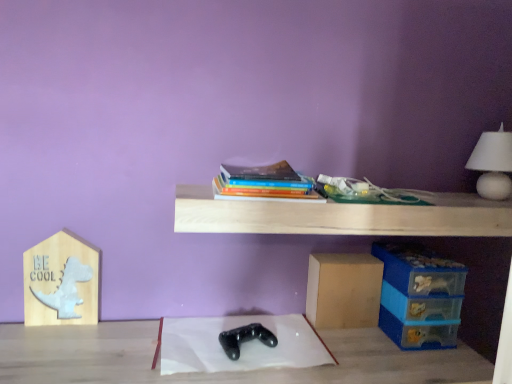
Question: Should I look upward or downward to see hardcover books at center?

Choices:
 (A) down
 (B) up

Answer: (B)

Question: Is blue plastic storage box at lower right at the left side of white matte table lamp at upper right?

Choices:
 (A) yes
 (B) no

Answer: (A)

Question: Is blue plastic storage box at lower right facing away from white matte table lamp at upper right?

Choices:
 (A) no
 (B) yes

Answer: (A)

Question: Can you confirm if blue plastic storage box at lower right is taller than white matte table lamp at upper right?

Choices:
 (A) yes
 (B) no

Answer: (A)

Question: From the image's perspective, is blue plastic storage box at lower right below white matte table lamp at upper right?

Choices:
 (A) yes
 (B) no

Answer: (A)

Question: From a real-world perspective, is blue plastic storage box at lower right beneath white matte table lamp at upper right?

Choices:
 (A) no
 (B) yes

Answer: (B)

Question: Is blue plastic storage box at lower right completely or partially outside of white matte table lamp at upper right?

Choices:
 (A) no
 (B) yes

Answer: (B)

Question: Is blue plastic storage box at lower right positioned with its back to white paper at center?

Choices:
 (A) no
 (B) yes

Answer: (A)

Question: Is blue plastic storage box at lower right to the right of white paper at center from the viewer's perspective?

Choices:
 (A) yes
 (B) no

Answer: (A)

Question: Is blue plastic storage box at lower right positioned behind white paper at center?

Choices:
 (A) no
 (B) yes

Answer: (B)

Question: Would you consider blue plastic storage box at lower right to be distant from white paper at center?

Choices:
 (A) no
 (B) yes

Answer: (A)

Question: Is blue plastic storage box at lower right positioned in front of white paper at center?

Choices:
 (A) no
 (B) yes

Answer: (A)

Question: Is blue plastic storage box at lower right next to white paper at center and touching it?

Choices:
 (A) yes
 (B) no

Answer: (B)

Question: Is the depth of light wood shelf at upper center greater than that of white matte table lamp at upper right?

Choices:
 (A) no
 (B) yes

Answer: (A)